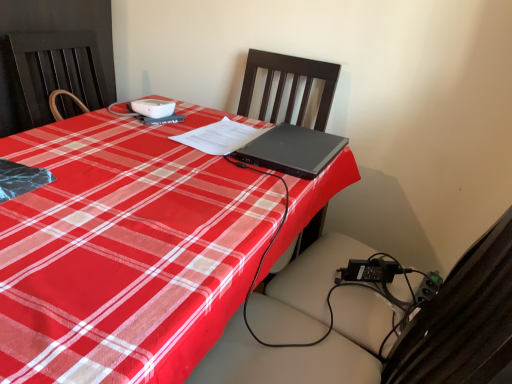
Question: Does point (333, 360) appear closer or farther from the camera than point (309, 226)?

Choices:
 (A) farther
 (B) closer

Answer: (B)

Question: Is black plastic swivel chair at center bigger or smaller than black wood chair at center?

Choices:
 (A) big
 (B) small

Answer: (A)

Question: Which object is the closest to the black plastic swivel chair at center?

Choices:
 (A) black wood chair at center
 (B) black matte laptop at center

Answer: (B)

Question: Which object is the farthest from the black plastic swivel chair at center?

Choices:
 (A) black wood chair at center
 (B) black matte laptop at center

Answer: (A)